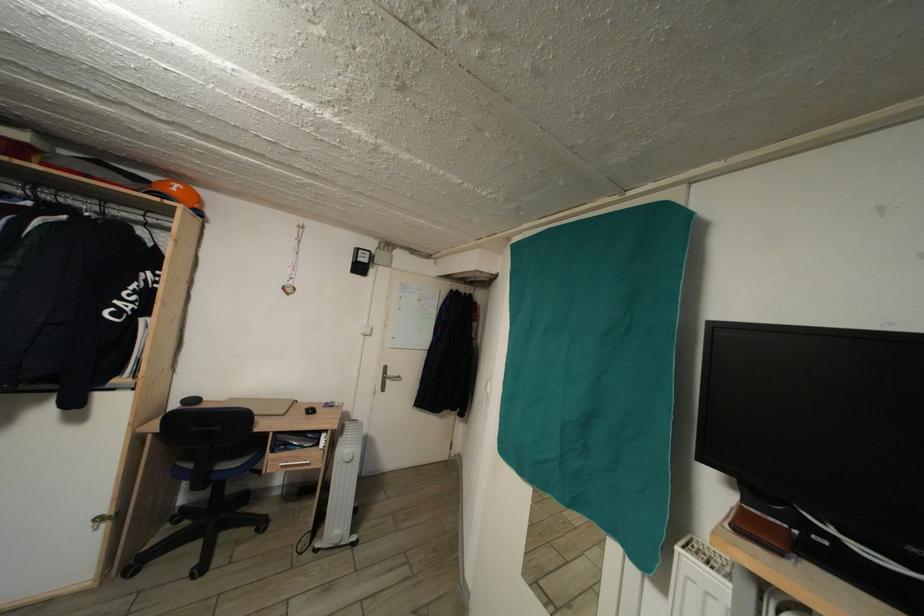
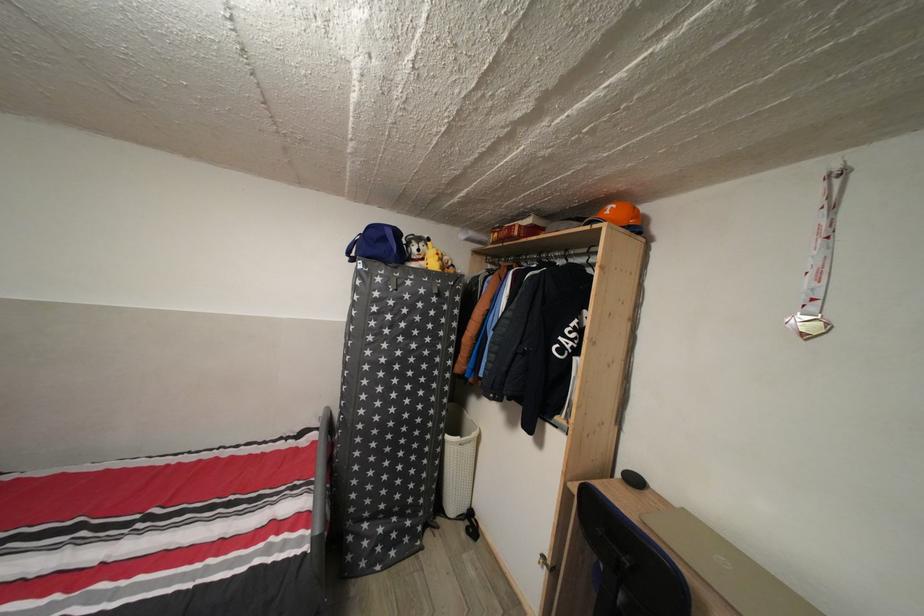
Question: The images are taken continuously from a first-person perspective. In which direction is your viewpoint rotating?

Choices:
 (A) Left
 (B) Right
 (C) Up
 (D) Down

Answer: (A)